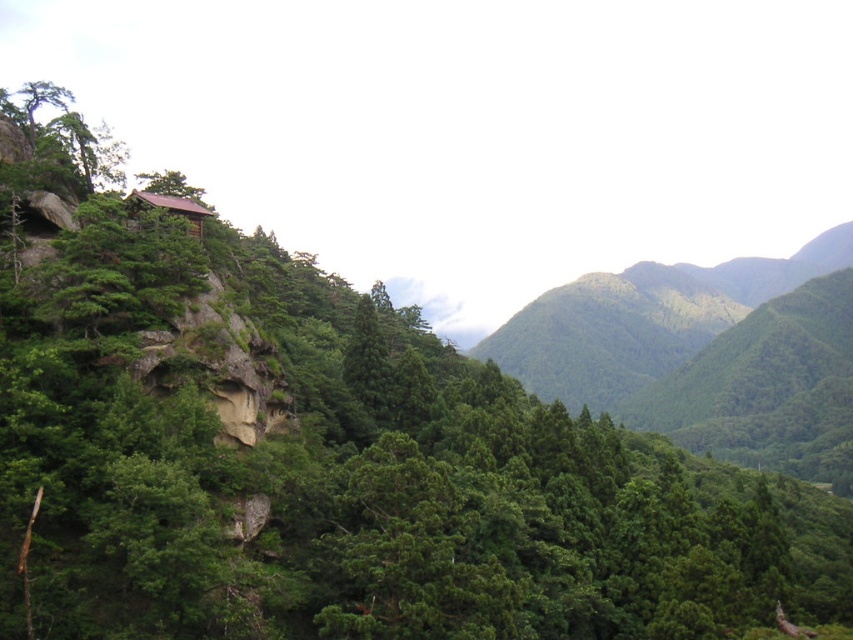
Question: Does green leafy forest at center have a lesser width compared to brown wooden hut at upper left?

Choices:
 (A) yes
 (B) no

Answer: (B)

Question: Among these points, which one is farthest from the camera?

Choices:
 (A) (730, 307)
 (B) (144, 198)

Answer: (A)

Question: Which object appears closest to the camera in this image?

Choices:
 (A) green leafy forest at center
 (B) brown wooden hut at upper left

Answer: (B)

Question: Which object appears closest to the camera in this image?

Choices:
 (A) green leafy forest at center
 (B) brown wooden hut at upper left

Answer: (B)

Question: Is the position of green leafy forest at center less distant than that of brown wooden hut at upper left?

Choices:
 (A) no
 (B) yes

Answer: (A)

Question: Does green leafy forest at center appear on the right side of brown wooden hut at upper left?

Choices:
 (A) yes
 (B) no

Answer: (A)